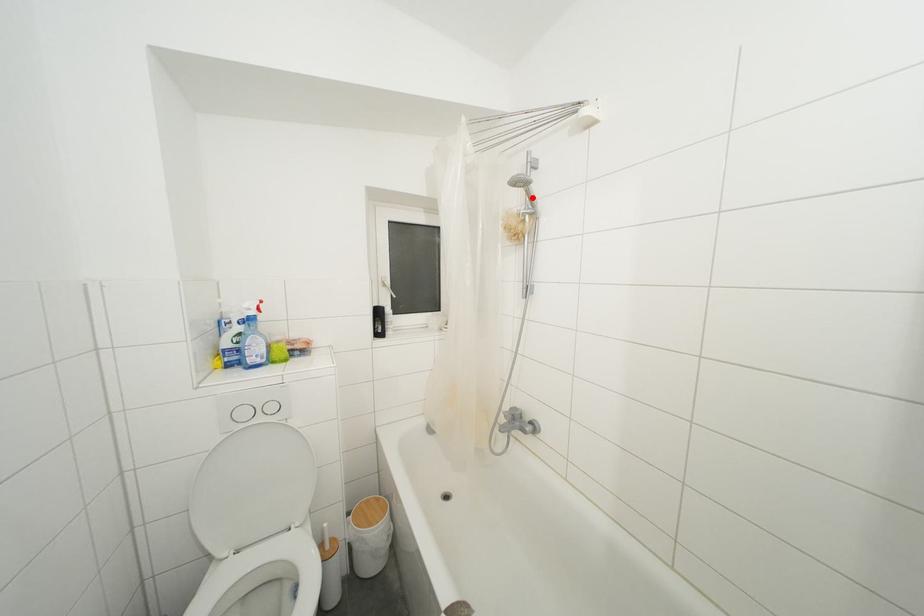
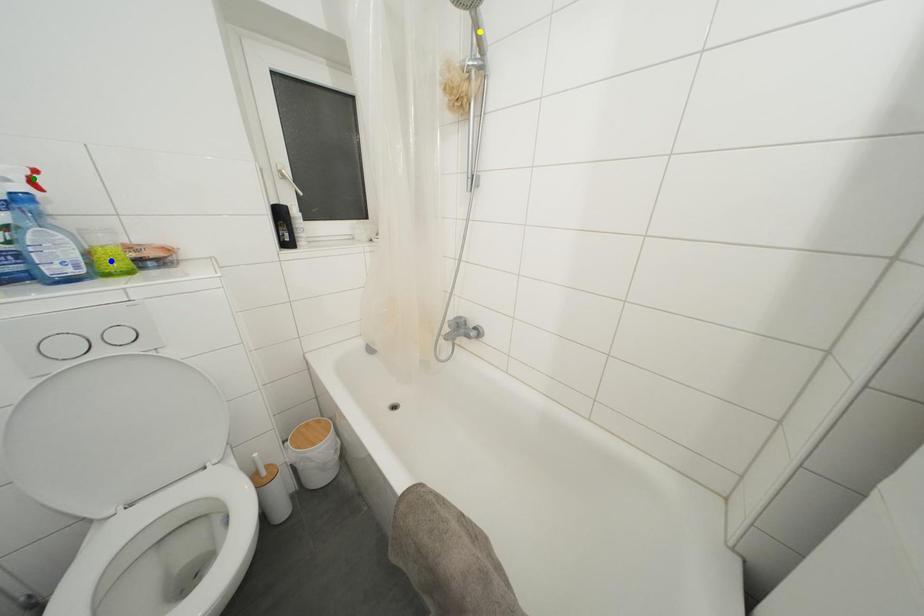
Question: I am providing you with two images of the same scene from different viewpoints. A red point is marked on the first image. You are given multiple points on the second image. Which point in image 2 represents the same 3d spot as the red point in image 1?

Choices:
 (A) blue point
 (B) yellow point
 (C) green point

Answer: (B)